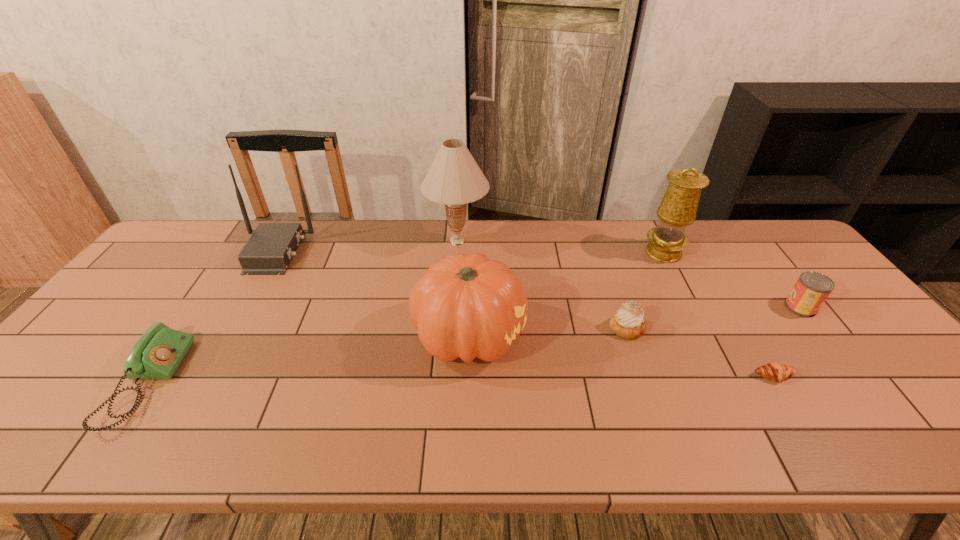
Image resolution: width=960 pixels, height=540 pixels. Find the location of `the shortest object`. the shortest object is located at coordinates (775, 371).

Identify the location of vacant region located 0.060m on the right of the lampshade. Image resolution: width=960 pixels, height=540 pixels. (507, 240).

You are a GUI agent. You are given a task and a screenshot of the screen. Output one action in this format:
    pyautogui.click(x=<x>, y=<y>)
    Task: Click on the free region located 0.230m on the front of the oil lamp
    
    Given the screenshot: What is the action you would take?
    pyautogui.click(x=697, y=319)

Locate an element on the screen. Image resolution: width=960 pixels, height=540 pixels. vacant area situated on the back of the router to connect cables is located at coordinates (409, 252).

Locate an element on the screen. This screenshot has height=540, width=960. blank area located on the carved face of the pumpkin is located at coordinates (579, 336).

At what (x,y) coordinates should I click in order to perform the action: click on vacant region located on the back of the fourth shortest object. Please return your answer as a coordinate pair (x, y). This screenshot has height=540, width=960. Looking at the image, I should click on (762, 258).

The height and width of the screenshot is (540, 960). Find the location of `vacant space located on the left of the fourth object from right to left`. vacant space located on the left of the fourth object from right to left is located at coordinates (511, 328).

This screenshot has width=960, height=540. I want to click on free space located on the dial of the telephone, so click(239, 383).

Find the location of a particular element. vacant point located on the front-facing side of the right pastry is located at coordinates (806, 431).

Locate an element on the screen. lampshade located in the far edge section of the desktop is located at coordinates click(454, 178).